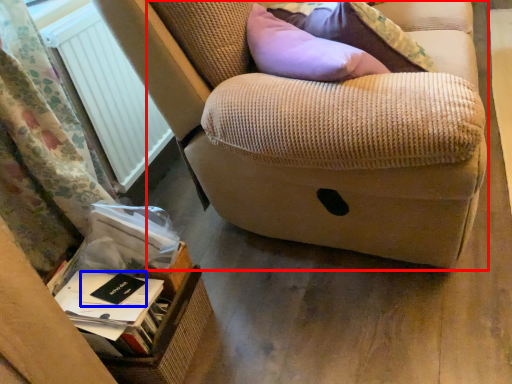
Question: Which point is further to the camera, furniture (highlighted by a red box) or paperback book (highlighted by a blue box)?

Choices:
 (A) furniture
 (B) paperback book

Answer: (B)